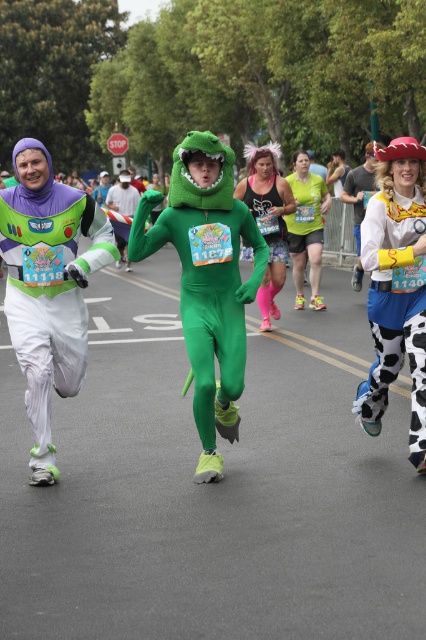
Who is taller, green spandex suit at center or neon green spandex at center?

green spandex suit at center

Who is shorter, green spandex suit at center or neon green spandex at center?

neon green spandex at center

The image size is (426, 640). I want to click on green spandex suit at center, so click(x=207, y=280).

Which is more to the left, matte purple and green costume at left or glow-in-the-dark fabric tank top at center?

From the viewer's perspective, matte purple and green costume at left appears more on the left side.

Is point (37, 186) behind point (284, 212)?

No.

Image resolution: width=426 pixels, height=640 pixels. What do you see at coordinates (48, 285) in the screenshot?
I see `matte purple and green costume at left` at bounding box center [48, 285].

This screenshot has width=426, height=640. Identify the location of matte purple and green costume at left. (48, 285).

Can you confirm if green spandex suit at center is bigger than cow print leggings at right?

Yes, green spandex suit at center is bigger than cow print leggings at right.

The height and width of the screenshot is (640, 426). What do you see at coordinates (207, 280) in the screenshot?
I see `green spandex suit at center` at bounding box center [207, 280].

The width and height of the screenshot is (426, 640). I want to click on green spandex suit at center, so click(x=207, y=280).